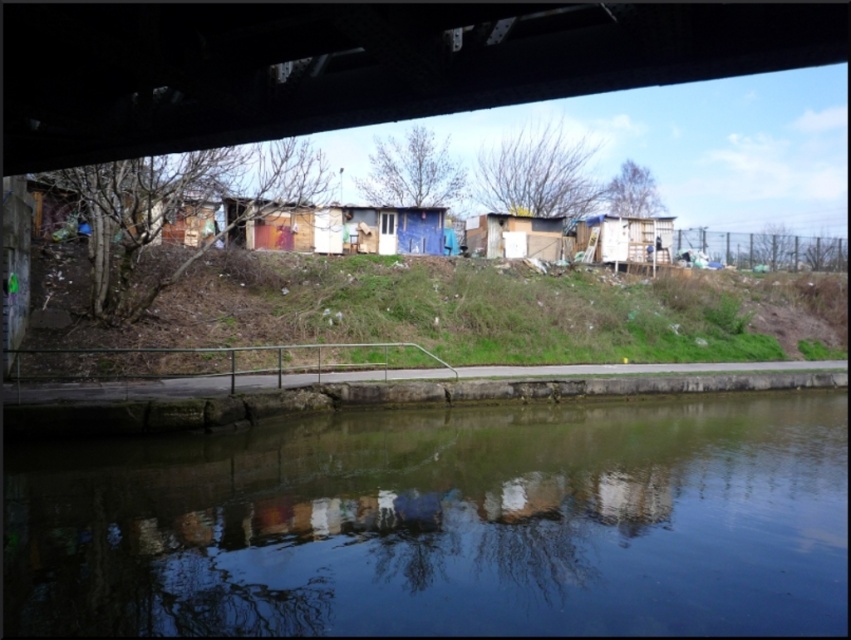
Does point (413, 243) come closer to viewer compared to point (598, 244)?

Yes.

What do you see at coordinates (393, 228) in the screenshot? I see `blue painted wood hut at center` at bounding box center [393, 228].

In order to click on blue painted wood hut at center in this screenshot , I will do `click(393, 228)`.

Which is more to the right, smooth concrete river at lower center or green grassy hillside at lower center?

smooth concrete river at lower center

Is smooth concrete river at lower center positioned before green grassy hillside at lower center?

Yes, it is in front of green grassy hillside at lower center.

Is point (614, 625) closer to viewer compared to point (366, 324)?

That is True.

The height and width of the screenshot is (640, 851). Identify the location of smooth concrete river at lower center. (443, 524).

Is point (586, 68) farther from viewer compared to point (478, 218)?

That is False.

At what (x,y) coordinates should I click in order to perform the action: click on dark gray concrete bridge at upper center. Please return your answer as a coordinate pair (x, y). Looking at the image, I should click on (353, 65).